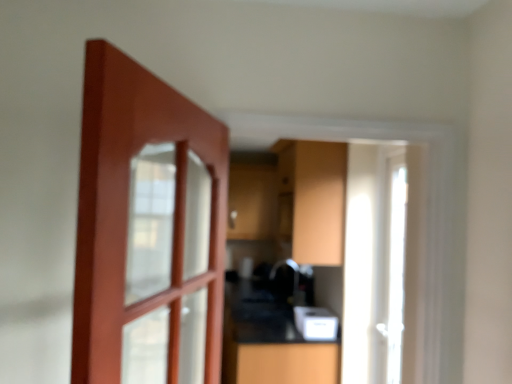
Question: In terms of height, does matte wood cabinet at center look taller or shorter compared to white plastic toaster at lower center?

Choices:
 (A) tall
 (B) short

Answer: (A)

Question: Considering the positions of point (309, 218) and point (309, 317), is point (309, 218) closer or farther from the camera than point (309, 317)?

Choices:
 (A) closer
 (B) farther

Answer: (A)

Question: Which object is positioned closest to the white plastic toaster at lower center?

Choices:
 (A) white glossy door at right
 (B) black glossy counter at center
 (C) matte wood cabinet at center

Answer: (B)

Question: Estimate the real-world distances between objects in this image. Which object is farther from the white glossy door at right?

Choices:
 (A) black glossy counter at center
 (B) white plastic toaster at lower center
 (C) matte wood cabinet at center

Answer: (A)